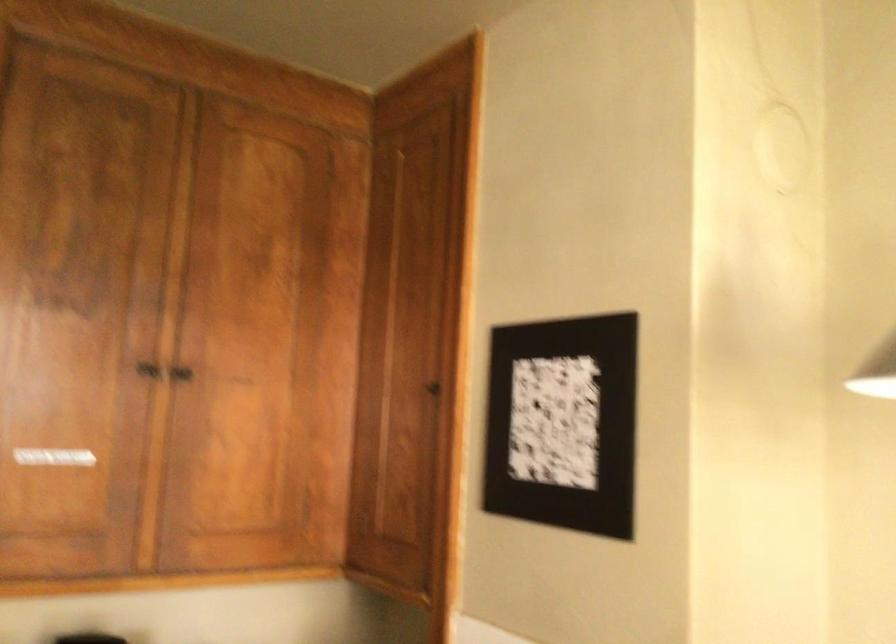
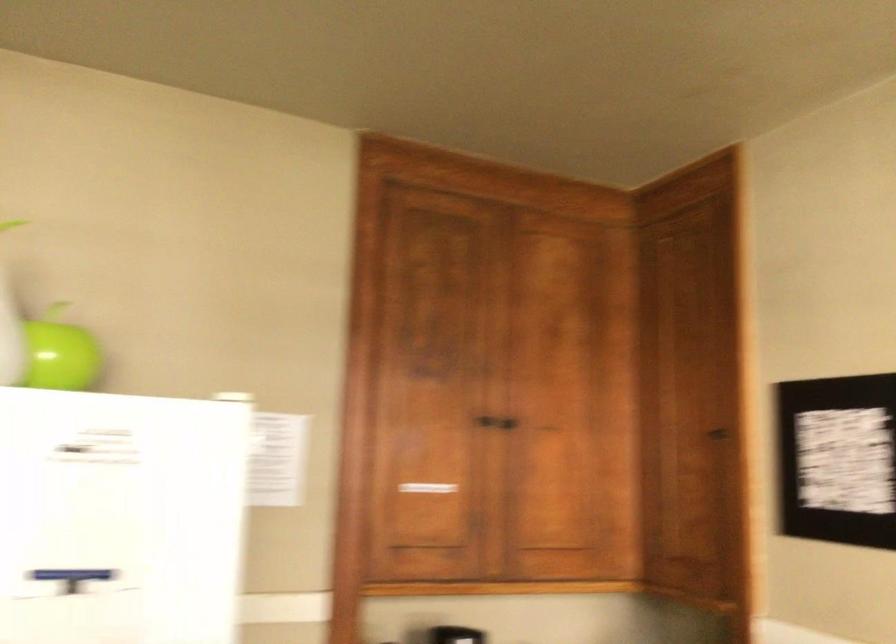
Find the pixel in the second image that matches point (201, 364) in the first image.

(511, 419)